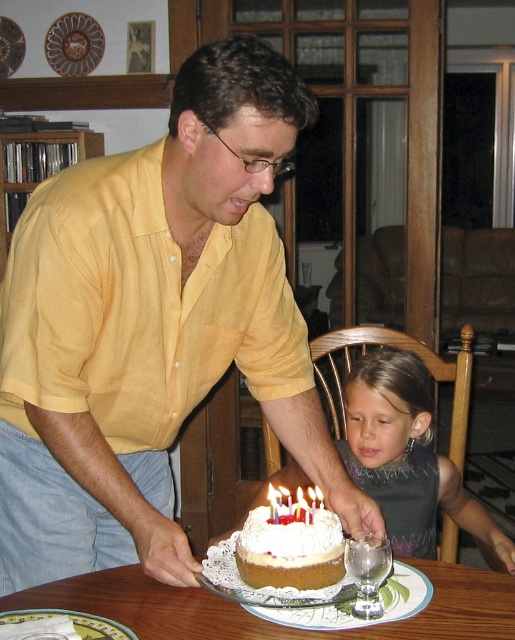
Question: Is smooth gray dress at center wider than white wax candle at center?

Choices:
 (A) yes
 (B) no

Answer: (A)

Question: Can you confirm if yellow cotton shirt at center is thinner than wooden table at center?

Choices:
 (A) yes
 (B) no

Answer: (A)

Question: Which is farther from the smooth gray dress at center?

Choices:
 (A) wooden table at center
 (B) white wax candle at center
 (C) yellow cotton shirt at center
 (D) white frosted cake at center

Answer: (D)

Question: Which object appears closest to the camera in this image?

Choices:
 (A) wooden table at center
 (B) smooth gray dress at center
 (C) white wax candle at center

Answer: (A)

Question: Does smooth gray dress at center have a smaller size compared to white frosted cake at center?

Choices:
 (A) yes
 (B) no

Answer: (B)

Question: Which of the following is the closest to the observer?

Choices:
 (A) white wax candle at center
 (B) yellow cotton shirt at center
 (C) smooth gray dress at center
 (D) white frosted cake at center

Answer: (B)